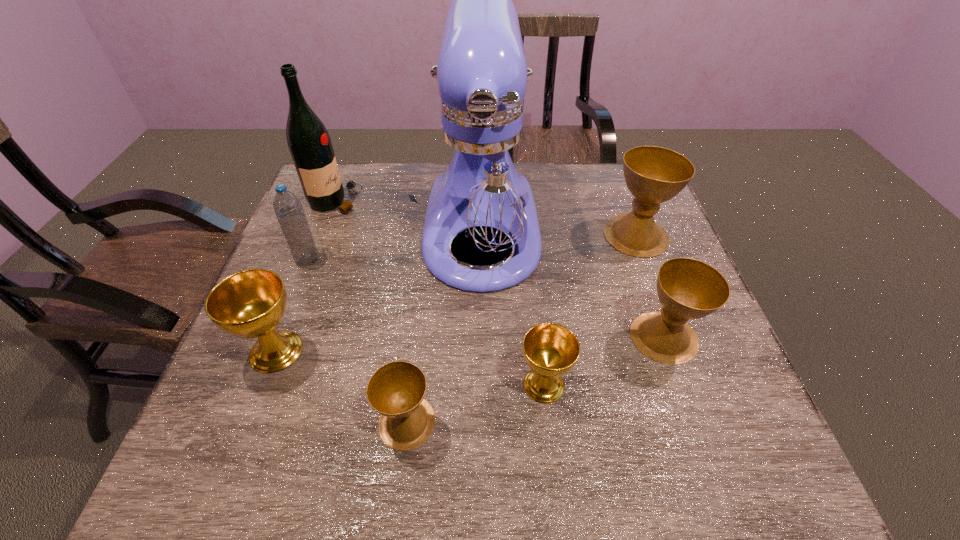
The width and height of the screenshot is (960, 540). In order to click on free space located 0.060m on the left of the nearest brown chalice in this screenshot , I will do `click(347, 422)`.

Find the location of a particular element. The height and width of the screenshot is (540, 960). vacant region located 0.110m on the right of the third chalice from left to right is located at coordinates (624, 385).

You are a GUI agent. You are given a task and a screenshot of the screen. Output one action in this format:
    pyautogui.click(x=<x>, y=<y>)
    Task: Click on the mixer that is at the far edge
    The height and width of the screenshot is (540, 960).
    Given the screenshot: What is the action you would take?
    pyautogui.click(x=481, y=183)

Where is `wine bottle situated at the far edge`? This screenshot has height=540, width=960. wine bottle situated at the far edge is located at coordinates (308, 140).

Find the location of a particular element. Image resolution: width=960 pixels, height=540 pixels. object situated at the near edge is located at coordinates (396, 390).

This screenshot has height=540, width=960. I want to click on wine bottle that is at the left edge, so click(x=308, y=140).

What are the coordinates of `water bottle located in the left edge section of the desktop` in the screenshot? It's located at (288, 209).

Where is `chalice situated at the left edge`? This screenshot has width=960, height=540. chalice situated at the left edge is located at coordinates (249, 304).

Identify the location of object situated at the far left corner. The image size is (960, 540). (308, 140).

This screenshot has height=540, width=960. Find the location of `blank space at the far edge of the desktop`. blank space at the far edge of the desktop is located at coordinates (394, 187).